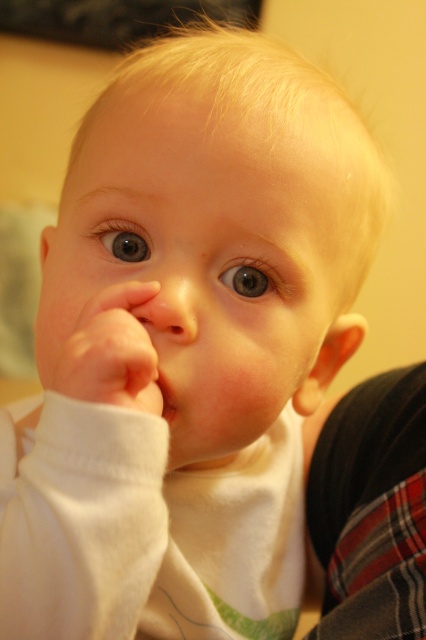
Based on the scene described, can you determine if the white soft hand at center is wider than the pink smooth lips at center?

Yes, the white soft hand at center is wider than the pink smooth lips at center according to the description.